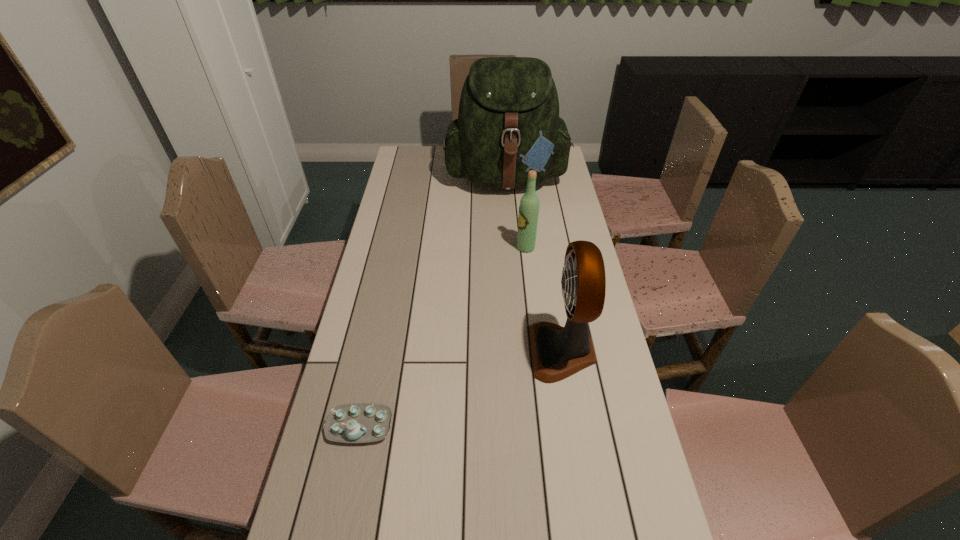
Image resolution: width=960 pixels, height=540 pixels. I want to click on object situated at the far right corner, so click(x=508, y=123).

At what (x,y) coordinates should I click in order to perform the action: click on vacant space at the far edge. Please return your answer as a coordinate pair (x, y). The height and width of the screenshot is (540, 960). Looking at the image, I should click on (441, 157).

Locate an element on the screen. This screenshot has width=960, height=540. vacant space at the left edge of the desktop is located at coordinates (405, 282).

What are the coordinates of `vacant space at the right edge of the desktop` in the screenshot? It's located at (567, 203).

The image size is (960, 540). Find the location of `vacant space at the far left corner`. vacant space at the far left corner is located at coordinates (426, 169).

Find the location of `vacant space that's between the second tallest object and the third tallest object`. vacant space that's between the second tallest object and the third tallest object is located at coordinates (544, 299).

At what (x,y) coordinates should I click in order to perform the action: click on vacant point located between the tallest object and the nearest object. Please return your answer as a coordinate pair (x, y). Looking at the image, I should click on (433, 302).

Find the location of a particular element. This screenshot has width=960, height=540. free space between the farthest object and the fan is located at coordinates (535, 265).

At what (x,y) coordinates should I click in order to perform the action: click on empty space that is in between the wine bottle and the leftmost object. Please return your answer as a coordinate pair (x, y). The width and height of the screenshot is (960, 540). Looking at the image, I should click on (443, 336).

The width and height of the screenshot is (960, 540). Find the location of `free spot between the chinaware and the fan`. free spot between the chinaware and the fan is located at coordinates (461, 388).